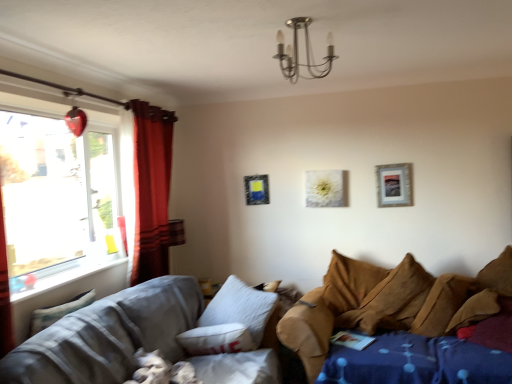
Question: From the image's perspective, is white matte canvas at center, arranged as the second picture frame when viewed from the front, located above or below white painted wood at left?

Choices:
 (A) above
 (B) below

Answer: (A)

Question: Considering the relative positions of white matte canvas at center, which ranks as the second picture frame in right-to-left order, and white painted wood at left in the image provided, is white matte canvas at center, which ranks as the second picture frame in right-to-left order, to the left or to the right of white painted wood at left?

Choices:
 (A) right
 (B) left

Answer: (A)

Question: Estimate the real-world distances between objects in this image. Which object is closer to the fluffy white pillow at lower left, the first pillow in the left-to-right sequence?

Choices:
 (A) white painted wood at left
 (B) textured gray fabric couch at lower left, which ranks as the 1th studio couch in left-to-right order
 (C) red velvet curtain at left
 (D) metallic chandelier at upper center
 (E) silver metallic picture frame at upper right, the 1th picture frame positioned from the front

Answer: (A)

Question: Which of these objects is positioned closest to the white matte canvas at center, which is the 1th picture frame in back-to-front order?

Choices:
 (A) red velvet curtain at left
 (B) brown textured pillow at right, which appears as the second pillow when viewed from the front
 (C) silver metallic picture frame at upper right, placed as the second picture frame when sorted from left to right
 (D) brown fabric couch at lower right, arranged as the 2th studio couch when viewed from the left
 (E) white painted wood at left

Answer: (C)